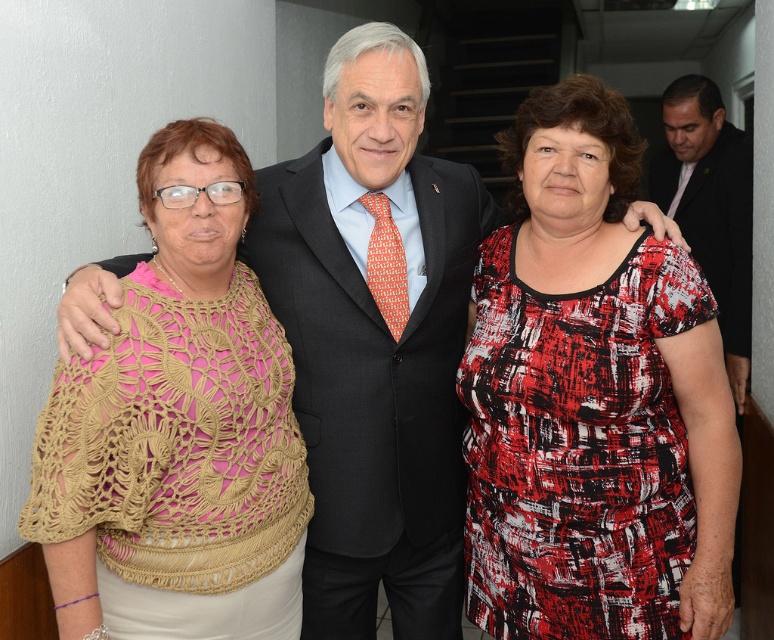
From the picture: You are standing in the hallway and want to move from the point at coordinates point(211, 240) to the point at coordinates point(303, 420). Which direction should you face to walk towards the second point?

You should face backward because point(211, 240) is in front of point(303, 420), so to reach point(303, 420) you need to move in the opposite direction.

You are a photographer setting up a shoot in a hallway. You have two items to place on a table in the scene described. The items are the crochet beige shawl at left and the black wool suit at center. The table is narrow and can only accommodate one item. Based on their widths, which item would you choose to place on the table to ensure it fits properly?

The crochet beige shawl at left has a lesser width compared to the black wool suit at center, so it would fit better on the narrow table.